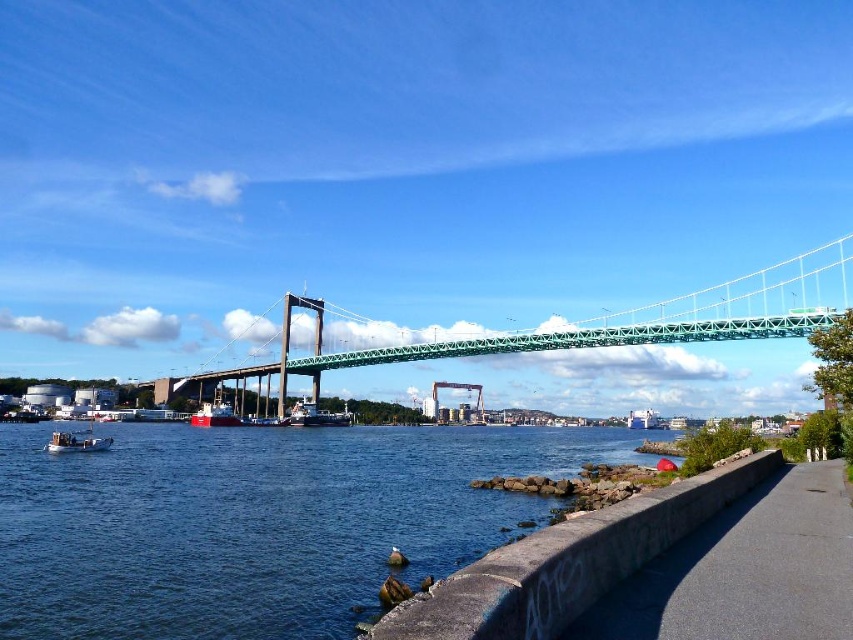
Is point (241, 509) less distant than point (103, 442)?

Yes, it is in front of point (103, 442).

Who is more forward, (238, 604) or (70, 451)?

Point (238, 604) is more forward.

Find the location of a particular element. blue water at lower center is located at coordinates tap(258, 522).

In the scene shown: Is blue water at lower center positioned at the back of green metallic suspension bridge at center?

No, it is in front of green metallic suspension bridge at center.

Who is lower down, blue water at lower center or green metallic suspension bridge at center?

blue water at lower center

Between point (252, 477) and point (595, 337), which one is positioned behind?

The point (595, 337) is behind.

What are the coordinates of `blue water at lower center` in the screenshot? It's located at (258, 522).

Measure the distance between point (787, 545) and camera.

A distance of 79.86 feet exists between point (787, 545) and camera.

Who is positioned more to the right, asphalt road at lower right or green metallic suspension bridge at center?

From the viewer's perspective, green metallic suspension bridge at center appears more on the right side.

Locate an element on the screen. The height and width of the screenshot is (640, 853). asphalt road at lower right is located at coordinates (746, 570).

Image resolution: width=853 pixels, height=640 pixels. In order to click on asphalt road at lower right in this screenshot , I will do `click(746, 570)`.